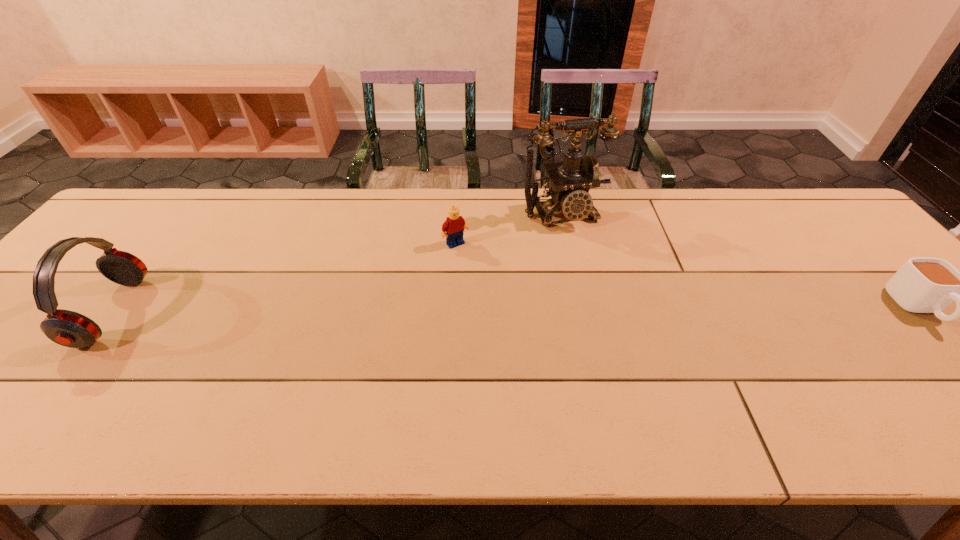
Image resolution: width=960 pixels, height=540 pixels. In order to click on the leftmost object in this screenshot , I will do `click(67, 328)`.

The width and height of the screenshot is (960, 540). Find the location of `earphone`. earphone is located at coordinates (67, 328).

I want to click on the second shortest object, so click(454, 225).

Locate an element on the screen. Lego is located at coordinates (454, 225).

Find the location of a particular element. the third object from left to right is located at coordinates (570, 181).

Locate an element on the screen. The width and height of the screenshot is (960, 540). the farthest object is located at coordinates (570, 181).

You are a GUI agent. You are given a task and a screenshot of the screen. Output one action in this format:
    pyautogui.click(x=<x>, y=<y>)
    Task: Click on the vacant space situated 0.090m on the ear cups of the leftmost object
    This screenshot has width=960, height=540.
    Given the screenshot: What is the action you would take?
    pyautogui.click(x=54, y=312)

You are a GUI agent. You are given a task and a screenshot of the screen. Output one action in this format:
    pyautogui.click(x=<x>, y=<y>)
    Task: Click on the vacant space located on the ear cups of the leftmost object
    
    Given the screenshot: What is the action you would take?
    pyautogui.click(x=33, y=312)

This screenshot has width=960, height=540. Find the location of `free spot located 0.340m on the front-facing side of the Lego`. free spot located 0.340m on the front-facing side of the Lego is located at coordinates (530, 333).

The width and height of the screenshot is (960, 540). What are the coordinates of `free space located 0.160m on the front-facing side of the Lego` in the screenshot? It's located at (491, 285).